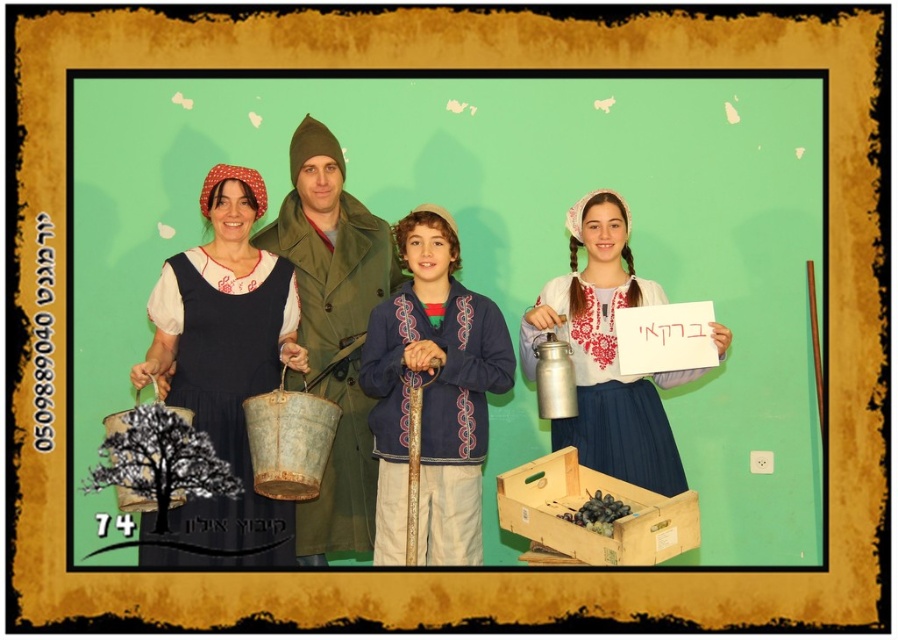
Question: Estimate the real-world distances between objects in this image. Which object is closer to the metallic silver milk can at right?

Choices:
 (A) metal bucket at center
 (B) wooden crate at lower center
 (C) blue embroidered jacket at center
 (D) green fabric coat at center

Answer: (C)

Question: Can you confirm if blue embroidered jacket at center is bigger than wooden crate at lower center?

Choices:
 (A) no
 (B) yes

Answer: (B)

Question: Can you confirm if blue embroidered jacket at center is positioned above metallic silver milk can at right?

Choices:
 (A) yes
 (B) no

Answer: (B)

Question: Does blue embroidered jacket at center appear over metallic silver milk can at right?

Choices:
 (A) no
 (B) yes

Answer: (A)

Question: Which of the following is the closest to the observer?

Choices:
 (A) (403, 406)
 (B) (232, 372)
 (C) (571, 316)

Answer: (A)

Question: Which point is farther to the camera?

Choices:
 (A) matte blue dress at left
 (B) metal bucket at center

Answer: (B)